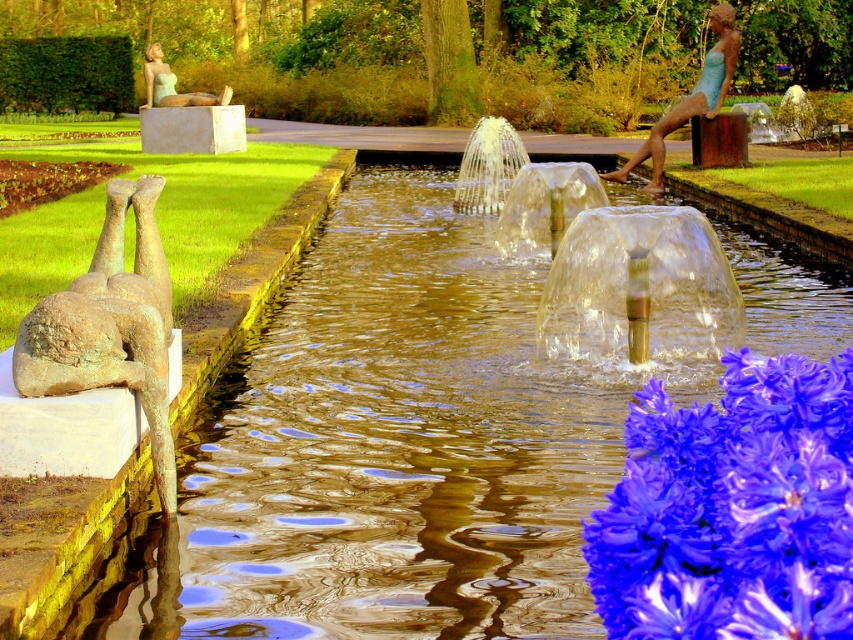
Question: Which point is farther from the camera taking this photo?

Choices:
 (A) (113, 218)
 (B) (643, 156)
 (C) (175, 97)
 (D) (178, 129)

Answer: (C)

Question: Does bronze statue at left have a greater width compared to green marble statue at upper left?

Choices:
 (A) yes
 (B) no

Answer: (B)

Question: Which object is farther from the camera taking this photo?

Choices:
 (A) bronze statue at left
 (B) matte green statue at upper left

Answer: (B)

Question: Is blue glossy flower at center positioned behind bronze statue at center?

Choices:
 (A) no
 (B) yes

Answer: (A)

Question: In this image, where is bronze statue at left located relative to bronze statue at center?

Choices:
 (A) left
 (B) right

Answer: (A)

Question: Which point is farther to the camera?

Choices:
 (A) (161, 90)
 (B) (149, 129)
 (C) (669, 124)
 (D) (624, 605)

Answer: (A)